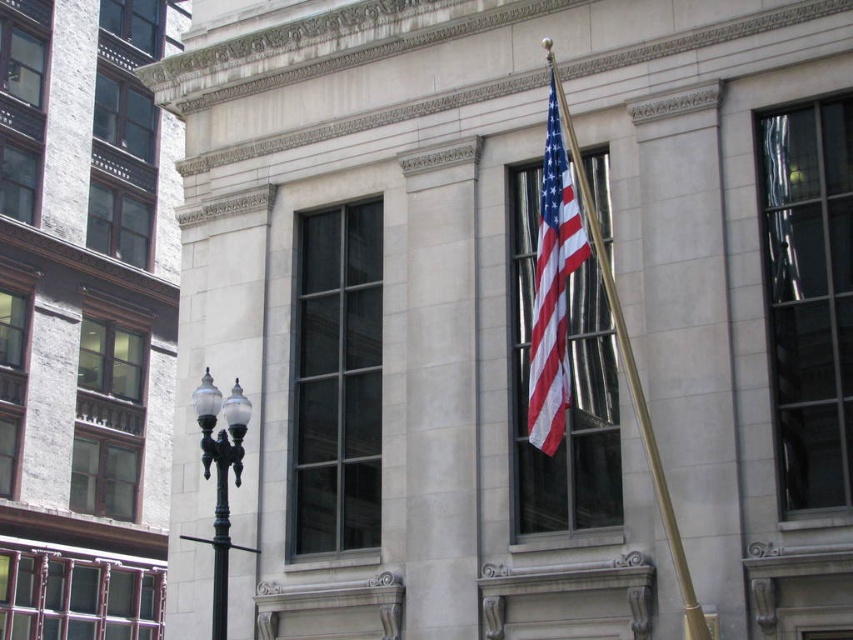
You are standing in front of the classical building and want to take a photo of the american flag at center and the polished black lamppost at lower left. Which object is positioned closer to you?

The american flag at center is closer to the viewer than the polished black lamppost at lower left.

You are a photographer planning to capture the American flag and its flagpole in a symmetrical composition. Given that the american flag at center is positioned above the gold polished flag pole at center, will the flag be visible in the frame if you focus on the flagpole?

Yes, the american flag at center is above the gold polished flag pole at center, so focusing on the flagpole will still allow the flag to be visible in the frame since it is positioned above it.